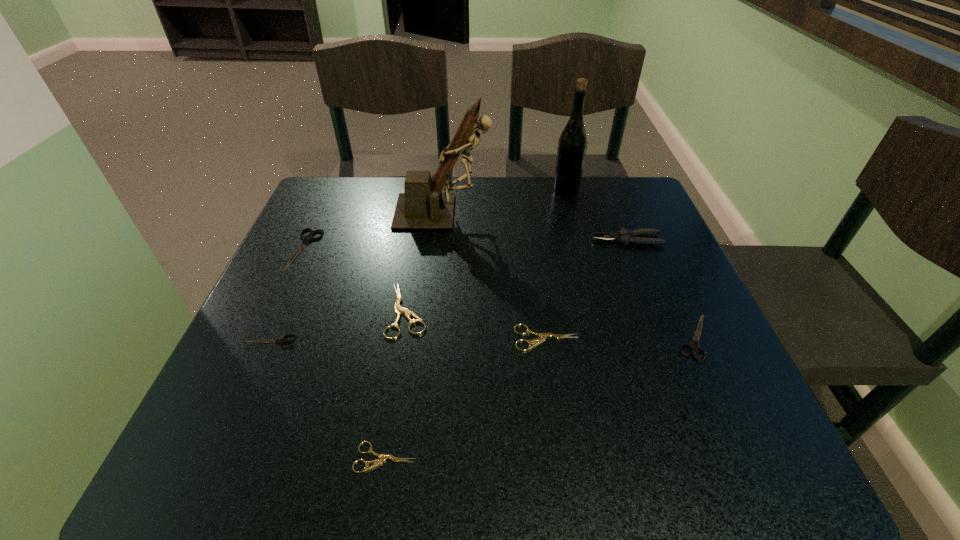
Locate an element on the screen. The image size is (960, 540). the rightmost beige shears is located at coordinates (544, 336).

Find the location of a particular element. The image size is (960, 540). the smallest black shears is located at coordinates (282, 341).

You are a GUI agent. You are given a task and a screenshot of the screen. Output one action in this format:
    pyautogui.click(x=<x>, y=<y>)
    Task: Click on the nearest shears
    The width and height of the screenshot is (960, 540).
    Given the screenshot: What is the action you would take?
    pyautogui.click(x=382, y=457)

What are the coordinates of `the shortest object` in the screenshot? It's located at (382, 457).

You are a GUI agent. You are given a task and a screenshot of the screen. Output one action in this format:
    pyautogui.click(x=<x>, y=<y>)
    Task: Click on the free space located on the front-facing side of the brown figurine
    The width and height of the screenshot is (960, 540).
    Given the screenshot: What is the action you would take?
    pyautogui.click(x=538, y=212)

You are a GUI agent. You are given a task and a screenshot of the screen. Output one action in this format:
    pyautogui.click(x=<x>, y=<y>)
    Task: Click on the free space located on the front of the green beer bottle
    This screenshot has height=540, width=960.
    Given the screenshot: What is the action you would take?
    pyautogui.click(x=578, y=237)

This screenshot has width=960, height=540. In order to click on vacant space situated at the gripping part of the gray pliers in this screenshot , I will do `click(512, 240)`.

Where is `vacant region located 0.340m at the gripping part of the gray pliers`? vacant region located 0.340m at the gripping part of the gray pliers is located at coordinates (448, 240).

Find the location of a particular element. This screenshot has height=540, width=960. vacant space situated 0.080m at the gripping part of the gray pliers is located at coordinates (559, 240).

At what (x,y) coordinates should I click in order to perform the action: click on vacant region located 0.310m on the front of the farthest shears. Please return your answer as a coordinate pair (x, y). The height and width of the screenshot is (540, 960). Looking at the image, I should click on (237, 399).